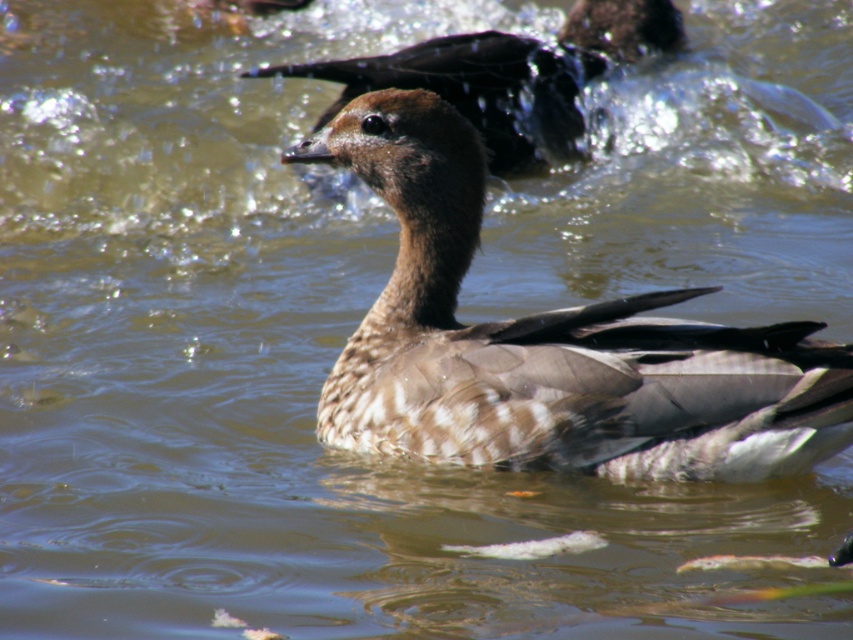
You are a wildlife photographer aiming to capture the brown feathered duck at center and the brown feathered goose at upper center in a single shot. Based on their sizes, which bird should you focus on first to ensure both are in frame?

The brown feathered duck at center is bigger than the brown feathered goose at upper center, so you should focus on the brown feathered duck at center first to ensure both fit in the frame.

You are a birdwatcher observing the scene. You notice the brown feathered duck at center and the brown feathered goose at upper center. Which bird is taller?

The brown feathered duck at center is much taller than the brown feathered goose at upper center.

You are a wildlife photographer aiming to capture the brown feathered duck at center and the brown feathered goose at upper center. Which bird has a narrower body?

The brown feathered duck at center is thinner than the brown feathered goose at upper center, so the brown feathered duck at center has a narrower body.